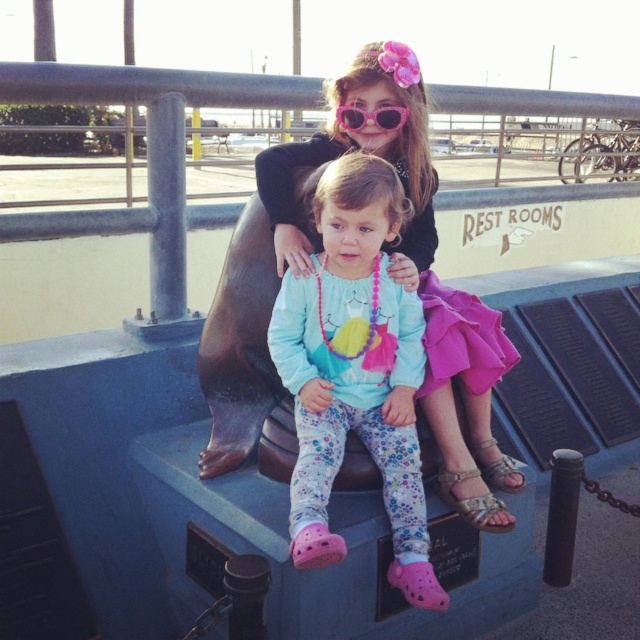
You are a photographer trying to capture a closeup shot of the pink plastic sunglasses at upper center while also including the fluffy cotton pants at center in the frame. Given that your camera has a maximum focus range of 1 meter, will you be able to achieve this shot?

The fluffy cotton pants at center is 1.04 meters from pink plastic sunglasses at upper center. Since the distance between them is slightly over 1 meter, the camera cannot focus on both objects simultaneously within the 1 meter range. Therefore, the photographer cannot achieve this shot.

You are a photographer trying to capture a closeup of the two points in the image. Which point, point (x=394, y=90) or point (x=401, y=113), is closer to you?

Point (x=394, y=90) is closer to the viewer than point (x=401, y=113).